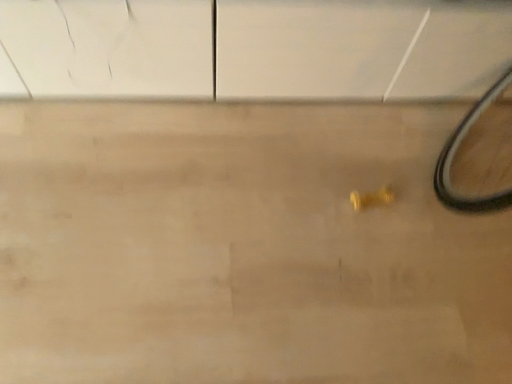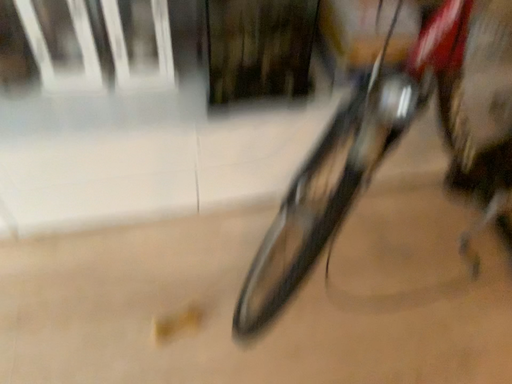
Question: How did the camera likely rotate when shooting the video?

Choices:
 (A) rotated downward
 (B) rotated upward

Answer: (B)